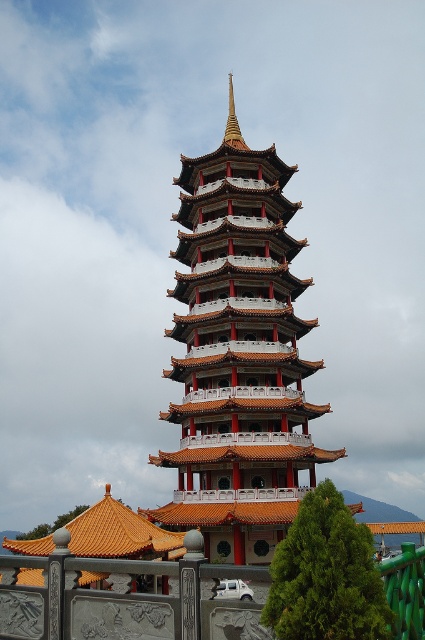
Question: Can you confirm if orange glazed tile tower at center is wider than gray stone railing at lower center?

Choices:
 (A) yes
 (B) no

Answer: (B)

Question: Which object is the farthest from the gold polished spire at center?

Choices:
 (A) gray stone railing at lower center
 (B) orange glazed tile tower at center

Answer: (A)

Question: Which object appears closest to the camera in this image?

Choices:
 (A) orange glazed tile tower at center
 (B) gray stone railing at lower center

Answer: (B)

Question: Where is gray stone railing at lower center located in relation to gold polished spire at center in the image?

Choices:
 (A) left
 (B) right

Answer: (A)

Question: Where is orange glazed tile tower at center located in relation to gray stone railing at lower center in the image?

Choices:
 (A) above
 (B) below

Answer: (A)

Question: Which object is the farthest from the orange glazed tile tower at center?

Choices:
 (A) gray stone railing at lower center
 (B) gold polished spire at center

Answer: (A)